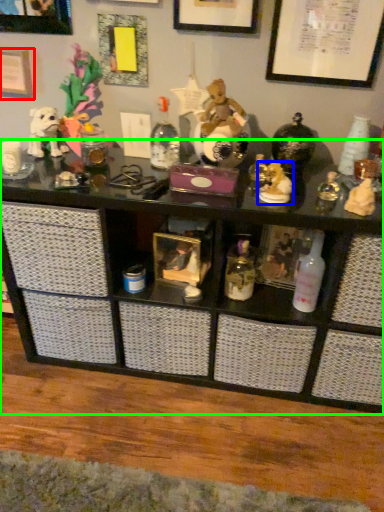
Question: Which is farther away from picture frame (highlighted by a red box)? toy (highlighted by a blue box) or shelf (highlighted by a green box)?

Choices:
 (A) toy
 (B) shelf

Answer: (A)